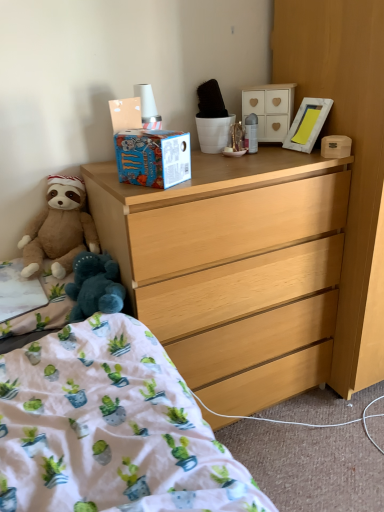
Question: Considering the relative sizes of white matte cabinet at upper center, placed as the first cabinetry when sorted from top to bottom, and white cotton bed at lower left in the image provided, is white matte cabinet at upper center, placed as the first cabinetry when sorted from top to bottom, smaller than white cotton bed at lower left?

Choices:
 (A) no
 (B) yes

Answer: (B)

Question: Is white matte cabinet at upper center, positioned as the 2th cabinetry in right-to-left order, thinner than white cotton bed at lower left?

Choices:
 (A) yes
 (B) no

Answer: (A)

Question: Is white matte cabinet at upper center, placed as the first cabinetry when sorted from top to bottom, not within white cotton bed at lower left?

Choices:
 (A) yes
 (B) no

Answer: (A)

Question: From a real-world perspective, does white matte cabinet at upper center, marked as the first cabinetry in a left-to-right arrangement, stand above white cotton bed at lower left?

Choices:
 (A) no
 (B) yes

Answer: (B)

Question: Is white matte cabinet at upper center, marked as the first cabinetry in a left-to-right arrangement, positioned in front of white cotton bed at lower left?

Choices:
 (A) no
 (B) yes

Answer: (A)

Question: Is white cotton bed at lower left inside the boundaries of white matte cabinet at upper center, placed as the first cabinetry when sorted from top to bottom, or outside?

Choices:
 (A) inside
 (B) outside

Answer: (B)

Question: Considering the positions of point (139, 502) and point (274, 131), is point (139, 502) closer or farther from the camera than point (274, 131)?

Choices:
 (A) closer
 (B) farther

Answer: (A)

Question: Looking at their shapes, would you say white cotton bed at lower left is wider or thinner than white matte cabinet at upper center, positioned as the 2th cabinetry in right-to-left order?

Choices:
 (A) thin
 (B) wide

Answer: (B)

Question: Based on their sizes in the image, would you say white cotton bed at lower left is bigger or smaller than white matte cabinet at upper center, positioned as the 2th cabinetry in right-to-left order?

Choices:
 (A) big
 (B) small

Answer: (A)

Question: In the image, is white matte cabinet at upper center, the second cabinetry ordered from the bottom, positioned in front of or behind white fabric at lower left, the 1th sheet from the bottom?

Choices:
 (A) front
 (B) behind

Answer: (B)

Question: From the image's perspective, is white matte cabinet at upper center, positioned as the 2th cabinetry in right-to-left order, positioned above or below white fabric at lower left, the 1th sheet from the bottom?

Choices:
 (A) above
 (B) below

Answer: (A)

Question: Considering the relative positions of white matte cabinet at upper center, the second cabinetry ordered from the bottom, and white fabric at lower left, marked as the second sheet in a top-to-bottom arrangement, in the image provided, is white matte cabinet at upper center, the second cabinetry ordered from the bottom, to the left or to the right of white fabric at lower left, marked as the second sheet in a top-to-bottom arrangement,?

Choices:
 (A) right
 (B) left

Answer: (A)

Question: Is white matte cabinet at upper center, placed as the first cabinetry when sorted from top to bottom, situated inside white fabric at lower left, marked as the second sheet in a top-to-bottom arrangement, or outside?

Choices:
 (A) inside
 (B) outside

Answer: (B)

Question: Considering the positions of point (210, 349) and point (77, 178), is point (210, 349) closer or farther from the camera than point (77, 178)?

Choices:
 (A) farther
 (B) closer

Answer: (B)

Question: In the image, is light wood dresser at center positioned in front of or behind brown plush teddy bear at left?

Choices:
 (A) behind
 (B) front

Answer: (B)